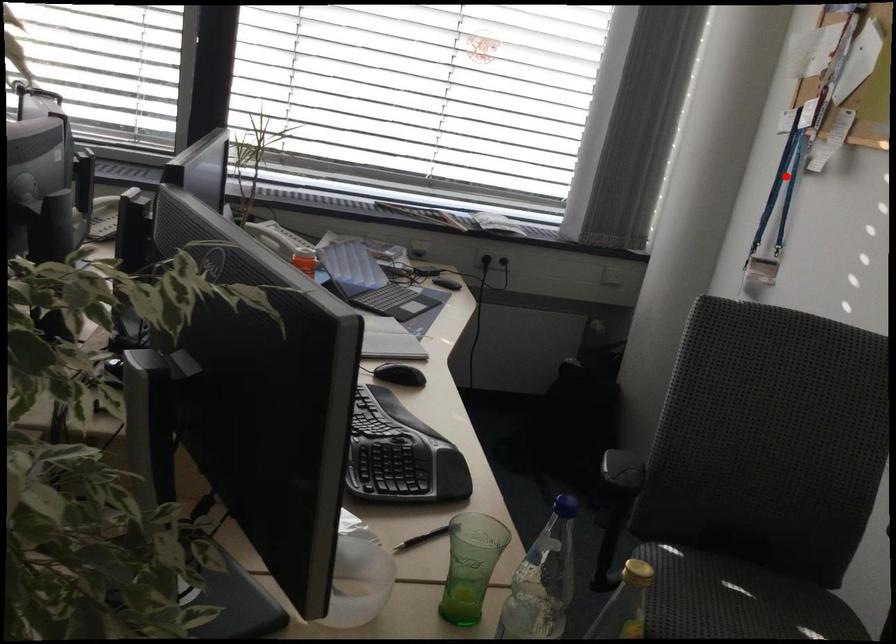
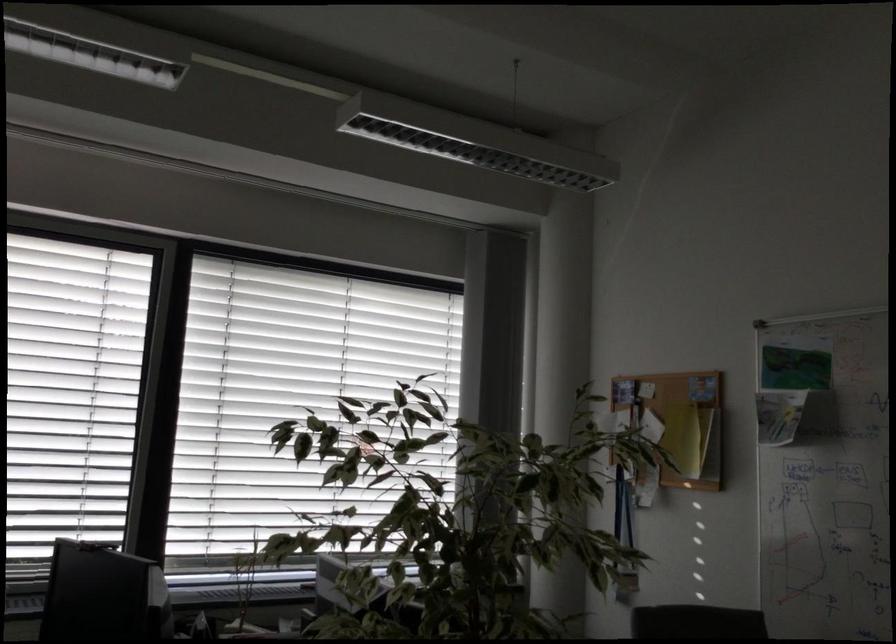
Where in the second image is the point corresponding to the highlighted location from the first image?

(623, 509)